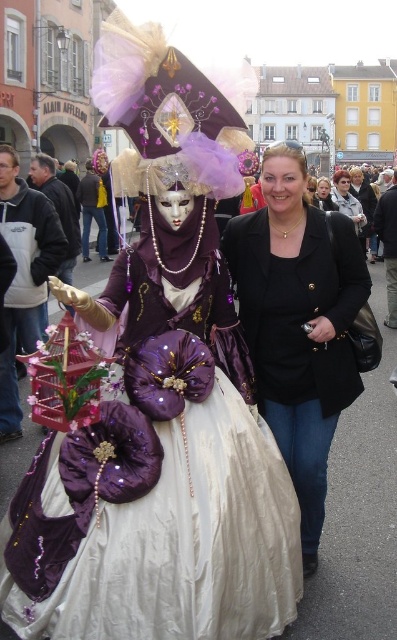
Is purple satin dress at center closer to the viewer compared to black matte jacket at center?

Yes, purple satin dress at center is closer to the viewer.

Does purple satin dress at center have a greater width compared to black matte jacket at center?

Yes.

Between point (161, 483) and point (316, 195), which one is positioned in front?

Point (161, 483)

Identify the location of purple satin dress at center. This screenshot has height=640, width=397. (158, 484).

Looking at this image, can you confirm if matte black jacket at center is positioned below black matte jacket at center?

No, matte black jacket at center is not below black matte jacket at center.

Which is more to the right, matte black jacket at center or black matte jacket at center?

matte black jacket at center is more to the right.

Does point (348, 208) come behind point (316, 193)?

No, (348, 208) is in front of (316, 193).

This screenshot has height=640, width=397. In order to click on matte black jacket at center in this screenshot , I will do `click(346, 198)`.

Between black matte blazer at center and matte black jacket at center, which one is positioned lower?

black matte blazer at center

Does black matte blazer at center have a greater width compared to matte black jacket at center?

Incorrect, black matte blazer at center's width does not surpass matte black jacket at center's.

Find the location of a particular element. This screenshot has height=640, width=397. black matte blazer at center is located at coordinates (298, 323).